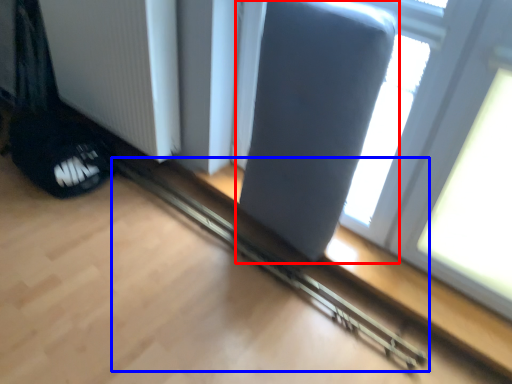
Question: Which object appears closest to the camera in this image, swivel chair (highlighted by a red box) or rail (highlighted by a blue box)?

Choices:
 (A) swivel chair
 (B) rail

Answer: (A)